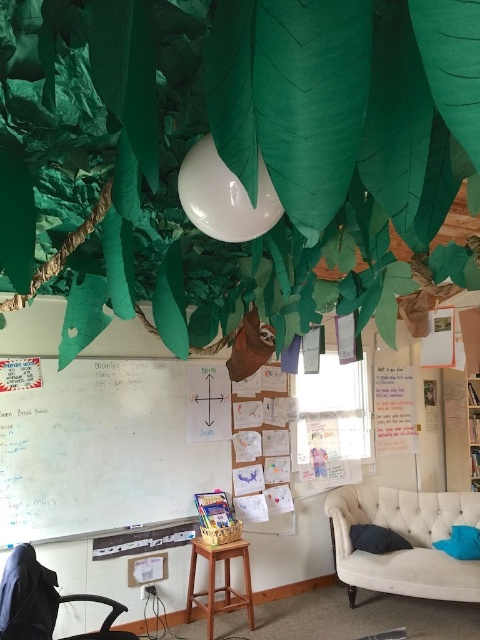
Question: Is whiteboard at left bigger than blue fabric pillow at lower right?

Choices:
 (A) yes
 (B) no

Answer: (A)

Question: Is black fabric armchair at lower left smaller than dark blue fabric pillow at lower right?

Choices:
 (A) no
 (B) yes

Answer: (A)

Question: Based on their relative distances, which object is farther from the black fabric armchair at lower left?

Choices:
 (A) white tufted couch at lower right
 (B) blue fabric pillow at lower right

Answer: (B)

Question: Among these points, which one is nearest to the camera?

Choices:
 (A) (350, 515)
 (B) (46, 614)
 (C) (87, 492)

Answer: (B)

Question: Which of these objects is positioned closest to the white tufted couch at lower right?

Choices:
 (A) whiteboard at left
 (B) dark blue fabric pillow at lower right

Answer: (B)

Question: Is white tufted couch at lower right positioned behind dark blue fabric pillow at lower right?

Choices:
 (A) no
 (B) yes

Answer: (A)